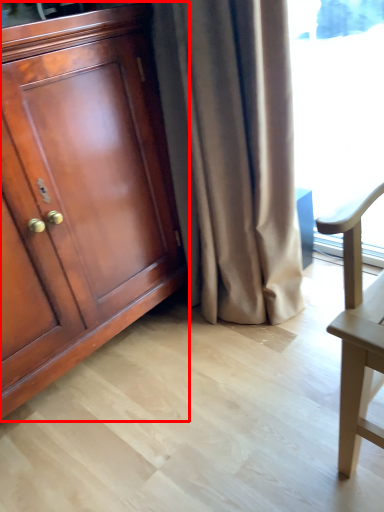
Question: Where is cabinetry (annotated by the red box) located in relation to curtain in the image?

Choices:
 (A) right
 (B) left

Answer: (B)